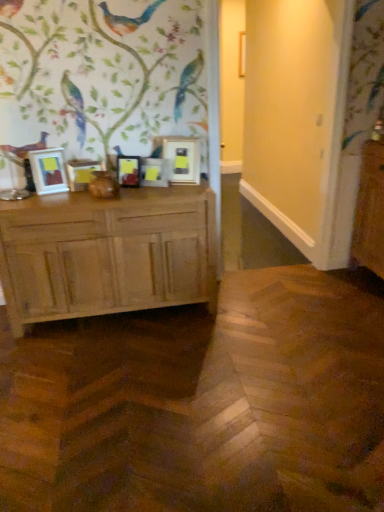
Question: Does matte wooden picture frame at left, placed as the second picture frame when sorted from left to right, lie behind matte gold picture frame at center, which is the first picture frame from right to left?

Choices:
 (A) yes
 (B) no

Answer: (B)

Question: Can you confirm if matte wooden picture frame at left, placed as the second picture frame when sorted from left to right, is thinner than matte gold picture frame at center, which is the first picture frame from right to left?

Choices:
 (A) no
 (B) yes

Answer: (B)

Question: Could you tell me if matte wooden picture frame at left, placed as the second picture frame when sorted from left to right, is facing matte gold picture frame at center, the fifth picture frame from the left?

Choices:
 (A) yes
 (B) no

Answer: (B)

Question: Considering the relative sizes of matte wooden picture frame at left, placed as the second picture frame when sorted from left to right, and matte gold picture frame at center, which is the first picture frame from right to left, in the image provided, is matte wooden picture frame at left, placed as the second picture frame when sorted from left to right, taller than matte gold picture frame at center, which is the first picture frame from right to left,?

Choices:
 (A) yes
 (B) no

Answer: (B)

Question: Is matte wooden picture frame at left, placed as the second picture frame when sorted from left to right, closer to the viewer compared to matte gold picture frame at center, which is the first picture frame from right to left?

Choices:
 (A) yes
 (B) no

Answer: (A)

Question: From the image's perspective, is matte wooden picture frame at left, the fourth picture frame from the right, below matte gold picture frame at center, the fifth picture frame from the left?

Choices:
 (A) no
 (B) yes

Answer: (B)

Question: Is matte wooden picture frame at center, which is counted as the 2th picture frame, starting from the right, outside of matte wooden picture frame at left, marked as the 1th picture frame in a left-to-right arrangement?

Choices:
 (A) no
 (B) yes

Answer: (B)

Question: From a real-world perspective, is matte wooden picture frame at center, which is the 4th picture frame from left to right, physically above matte wooden picture frame at left, marked as the 1th picture frame in a left-to-right arrangement?

Choices:
 (A) no
 (B) yes

Answer: (A)

Question: Is matte wooden picture frame at center, which is counted as the 2th picture frame, starting from the right, placed right next to matte wooden picture frame at left, which is the 5th picture frame from right to left?

Choices:
 (A) yes
 (B) no

Answer: (B)

Question: Is matte wooden picture frame at center, which is counted as the 2th picture frame, starting from the right, behind matte wooden picture frame at left, which is the 5th picture frame from right to left?

Choices:
 (A) no
 (B) yes

Answer: (B)

Question: Would you say matte wooden picture frame at left, which is the 5th picture frame from right to left, is part of matte wooden picture frame at center, which is counted as the 2th picture frame, starting from the right,'s contents?

Choices:
 (A) yes
 (B) no

Answer: (B)

Question: Is matte wooden picture frame at center, which is the 4th picture frame from left to right, far away from matte wooden picture frame at left, which is the 5th picture frame from right to left?

Choices:
 (A) no
 (B) yes

Answer: (A)

Question: Is the position of matte wooden picture frame at center, which is the 4th picture frame from left to right, less distant than that of matte black picture frame at center, which ranks as the third picture frame in left-to-right order?

Choices:
 (A) yes
 (B) no

Answer: (B)